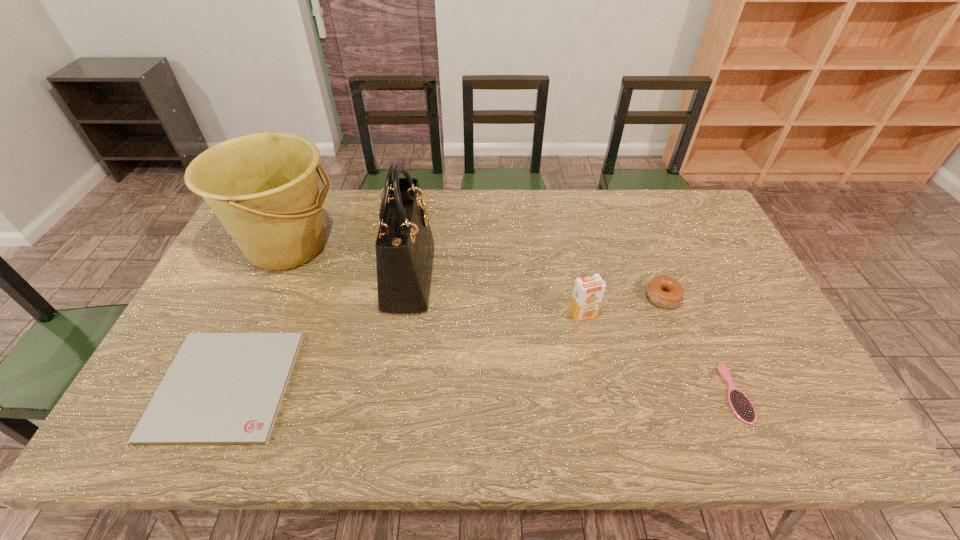
This screenshot has width=960, height=540. Find the location of `the second closest object to the fifth object from left to right`. the second closest object to the fifth object from left to right is located at coordinates (740, 404).

Locate an element on the screen. vacant region that satisfies the following two spatial constraints: 1. on the side of the bucket with the handle; 2. on the back side of the clipboard is located at coordinates (225, 386).

This screenshot has height=540, width=960. Find the location of `vacant region that satisfies the following two spatial constraints: 1. on the back side of the shortest object; 2. on the side of the bucket with the handle`. vacant region that satisfies the following two spatial constraints: 1. on the back side of the shortest object; 2. on the side of the bucket with the handle is located at coordinates (288, 246).

You are a GUI agent. You are given a task and a screenshot of the screen. Output one action in this format:
    pyautogui.click(x=<x>, y=<y>)
    Task: Click on the free location that satisfies the following two spatial constraints: 1. at the front of the handbag with visible charms; 2. on the left side of the third tallest object
    Image resolution: width=960 pixels, height=540 pixels.
    Given the screenshot: What is the action you would take?
    pyautogui.click(x=403, y=314)

Image resolution: width=960 pixels, height=540 pixels. I want to click on vacant space that satisfies the following two spatial constraints: 1. at the front of the third object from left to right with visible charms; 2. on the left side of the hairbrush, so click(x=392, y=393).

The image size is (960, 540). I want to click on vacant space that satisfies the following two spatial constraints: 1. on the front side of the fourth tallest object; 2. on the right side of the rightmost object, so click(699, 393).

Where is `vacant region that satisfies the following two spatial constraints: 1. at the front of the fourth tallest object with visible charms; 2. on the left side of the tallest object`? vacant region that satisfies the following two spatial constraints: 1. at the front of the fourth tallest object with visible charms; 2. on the left side of the tallest object is located at coordinates (406, 297).